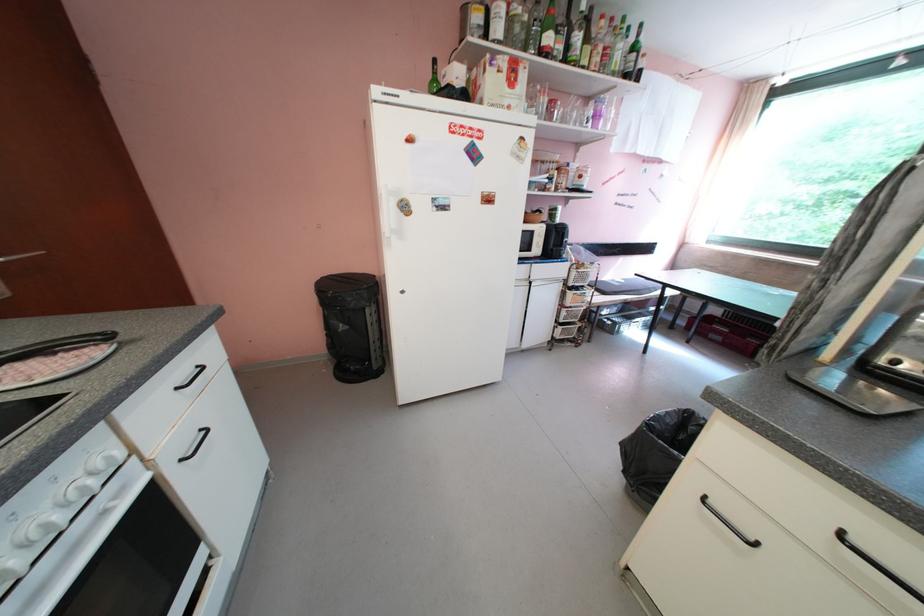
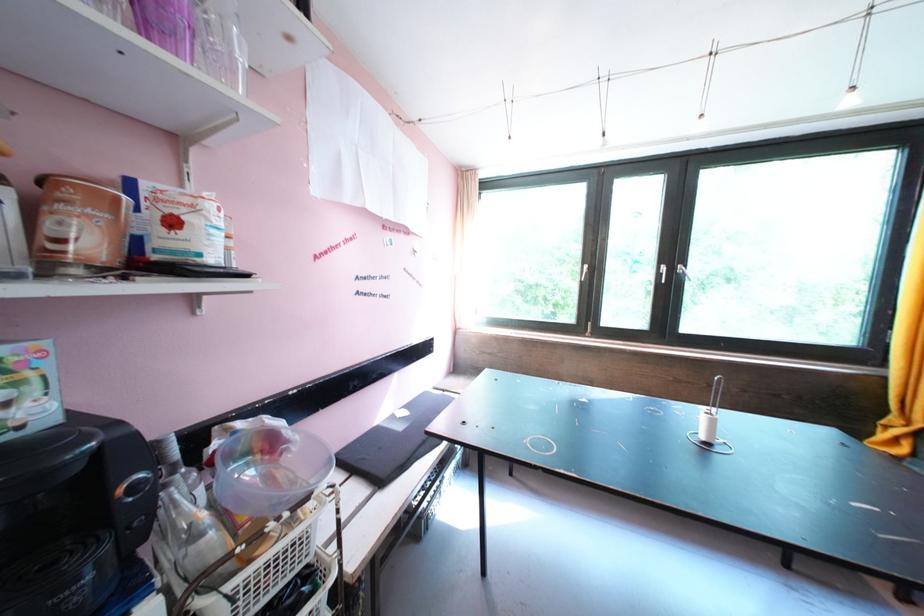
Locate, in the second image, the point that corresponds to [589,179] in the first image.

(181, 225)